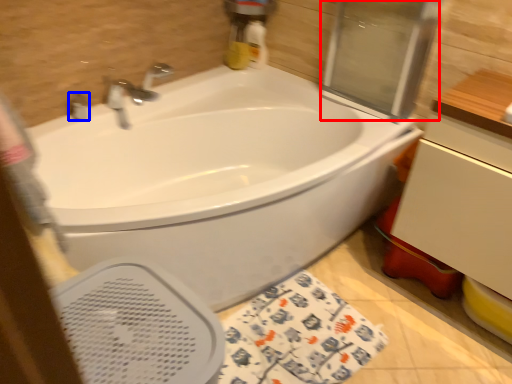
Question: Which point is closer to the camera, screen door (highlighted by a red box) or plumbing fixture (highlighted by a blue box)?

Choices:
 (A) screen door
 (B) plumbing fixture

Answer: (A)